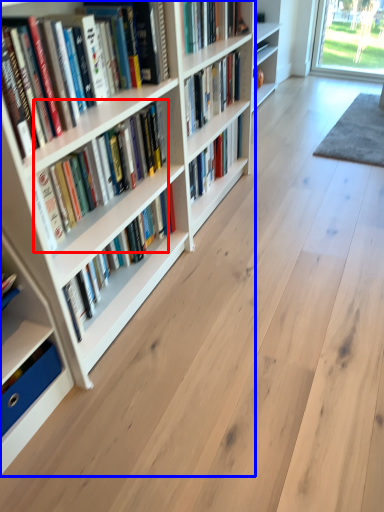
Question: Which point is closer to the camera, book (highlighted by a red box) or bookcase (highlighted by a blue box)?

Choices:
 (A) book
 (B) bookcase

Answer: (B)